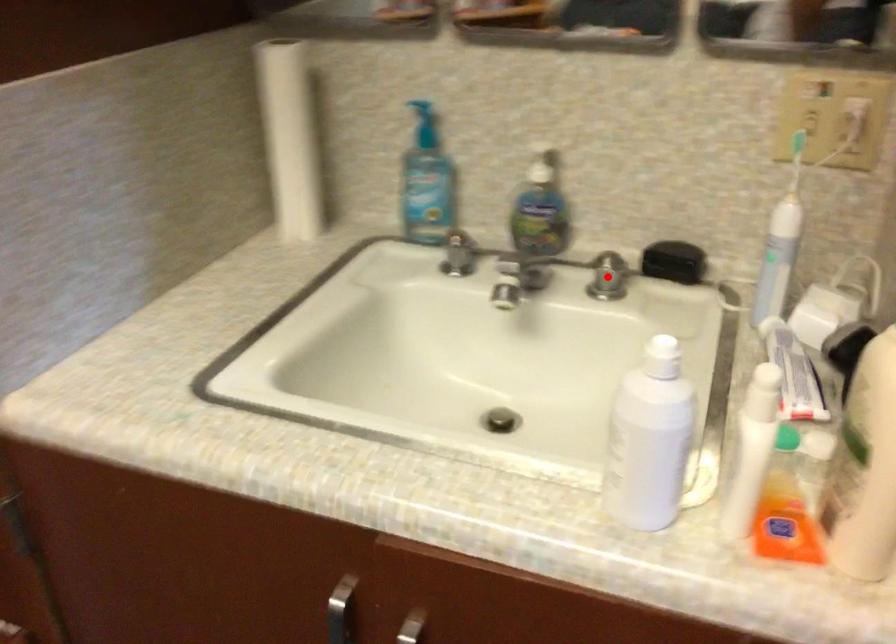
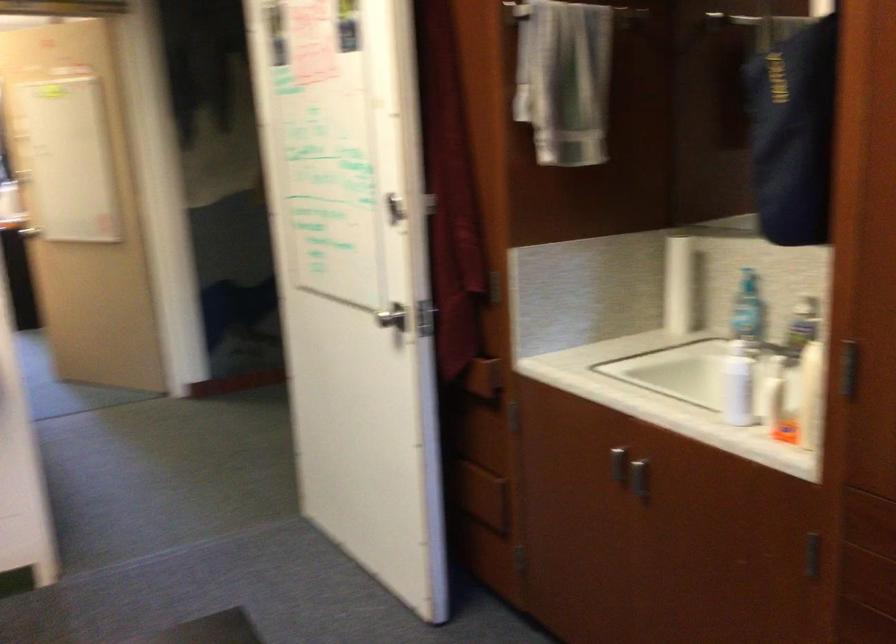
Question: I am providing you with two images of the same scene from different viewpoints. A red point is marked on the first image. Can you still see the location of the red point in image 2?

Choices:
 (A) Yes
 (B) No

Answer: (B)